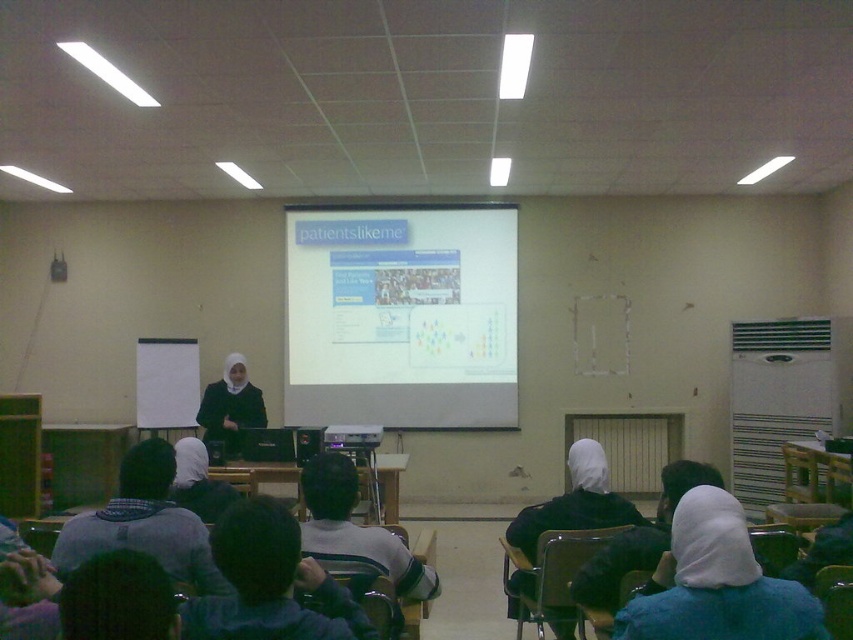
Question: Does white matte projection screen at center have a larger size compared to white matte hijab at lower right?

Choices:
 (A) yes
 (B) no

Answer: (A)

Question: Based on their relative distances, which object is farther from the white matte projection screen at center?

Choices:
 (A) black plastic projector at center
 (B) matte black hijab at center
 (C) gray knitted sweater at lower left

Answer: (C)

Question: Which object is positioned closest to the black plastic projector at center?

Choices:
 (A) white matte projection screen at center
 (B) matte black hijab at center
 (C) gray knitted sweater at lower left
 (D) white matte hijab at lower right

Answer: (B)

Question: Which of the following is the farthest from the observer?

Choices:
 (A) white matte projection screen at center
 (B) black plastic projector at center
 (C) white matte hijab at lower right

Answer: (A)

Question: Can you confirm if gray knitted sweater at lower left is wider than matte black hijab at center?

Choices:
 (A) yes
 (B) no

Answer: (A)

Question: Can you confirm if white matte projection screen at center is smaller than matte black hijab at center?

Choices:
 (A) yes
 (B) no

Answer: (B)